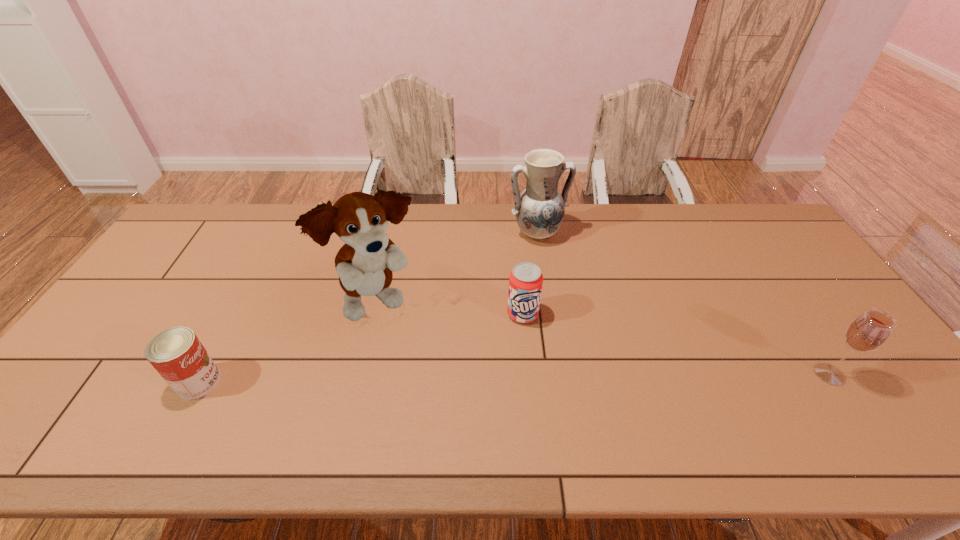
Find the location of a particular element. The width and height of the screenshot is (960, 540). object identified as the closest to the pottery is located at coordinates (525, 281).

Locate an element on the screen. free location that satisfies the following two spatial constraints: 1. on the back side of the puppy; 2. on the right side of the pottery is located at coordinates (395, 234).

At what (x,y) coordinates should I click in order to perform the action: click on free spot that satisfies the following two spatial constraints: 1. on the front side of the pottery; 2. on the left side of the rightmost object. Please return your answer as a coordinate pair (x, y). Looking at the image, I should click on (558, 374).